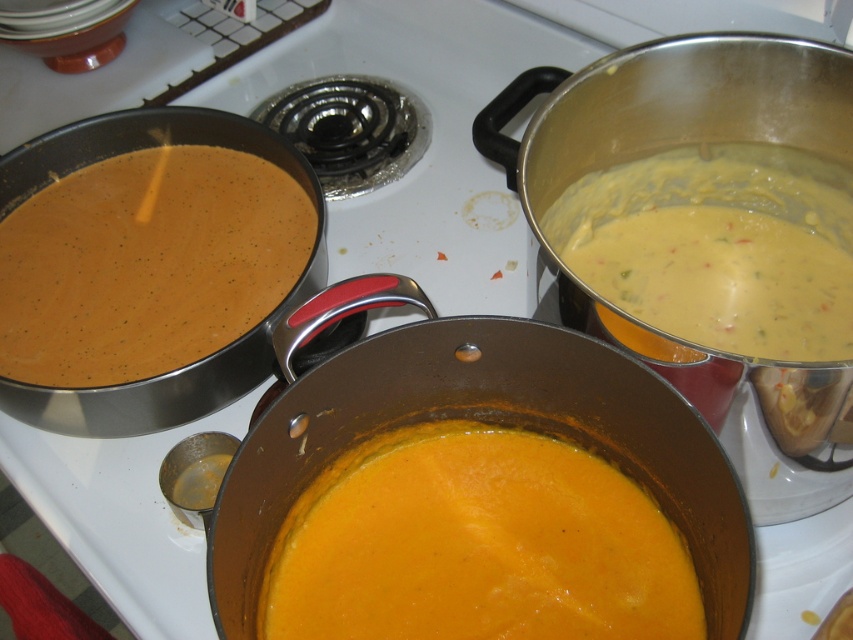
You are a chef trying to reach the matte stainless steel frying pan at upper left to stir the soup. However, the matte orange soup at center is blocking your view. Can you see the frying pan behind the soup?

The matte orange soup at center is in front of the matte stainless steel frying pan at upper left, so you cannot see the frying pan behind the soup.

You are standing in the kitchen and want to reach the point at coordinates point (x=555, y=458). If your arm can extend 24 inches, can you reach it?

The distance between you and the point (x=555, y=458) is 22.93 inches, so yes, your arm can reach it since it is within the 24 inches range.

You are a chef trying to locate the yellow creamy soup at upper right and the matte stainless steel frying pan at upper left in the kitchen. According to the scene, which object is positioned to the right of the other?

The yellow creamy soup at upper right is to the right of the matte stainless steel frying pan at upper left.